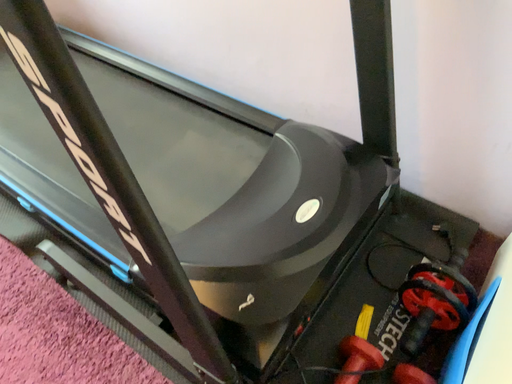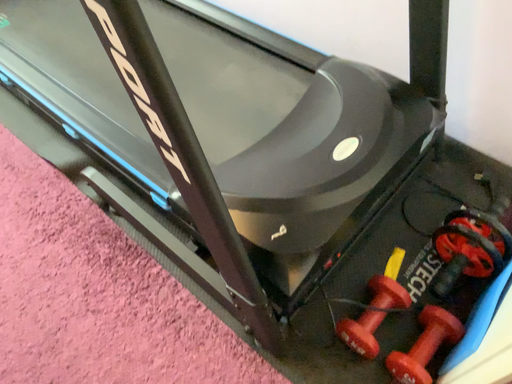
Question: How did the camera likely rotate when shooting the video?

Choices:
 (A) rotated upward
 (B) rotated downward

Answer: (B)